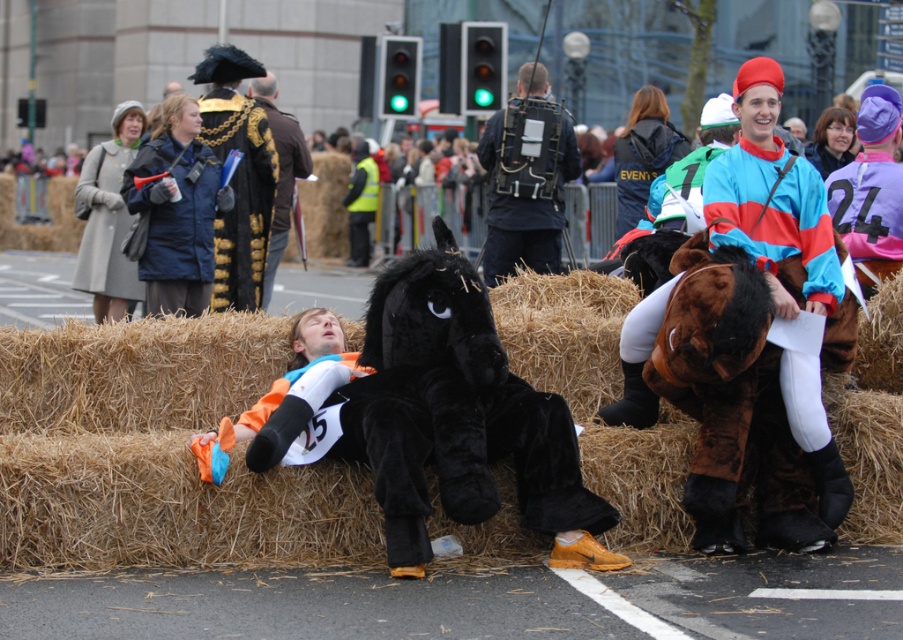
Question: Which object is closer to the camera taking this photo?

Choices:
 (A) light gray wool coat at upper left
 (B) teal and pink jersey at center
 (C) black plush horse at center

Answer: (C)

Question: Considering the relative positions of brown straw bale at center and black plush horse at center in the image provided, where is brown straw bale at center located with respect to black plush horse at center?

Choices:
 (A) left
 (B) right

Answer: (A)

Question: Which object is farther from the camera taking this photo?

Choices:
 (A) teal and pink jersey at center
 (B) brushed metal megaphone at upper left
 (C) brown straw bale at center
 (D) velvet black horse at center

Answer: (A)

Question: Does brown straw bale at center appear over teal and pink jersey at center?

Choices:
 (A) yes
 (B) no

Answer: (B)

Question: Can you confirm if gold brocade robe at upper left is positioned below velvet black horse at center?

Choices:
 (A) yes
 (B) no

Answer: (A)

Question: Which point appears closest to the camera in this image?

Choices:
 (A) (491, 253)
 (B) (104, 182)
 (C) (133, 163)
 (D) (734, 502)

Answer: (D)